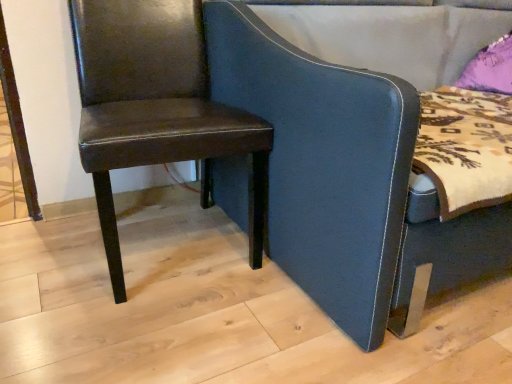
How much space does dark blue leather chair at center, the 2th chair in the left-to-right sequence, occupy horizontally?

dark blue leather chair at center, the 2th chair in the left-to-right sequence, is 3.59 feet in width.

This screenshot has height=384, width=512. Describe the element at coordinates (345, 179) in the screenshot. I see `dark blue leather chair at center, which is the 1th chair in right-to-left order` at that location.

Locate an element on the screen. The height and width of the screenshot is (384, 512). dark blue leather chair at center, the 2th chair in the left-to-right sequence is located at coordinates (345, 179).

How much space does matte brown leather chair at left, acting as the 2th chair starting from the right, occupy vertically?

Answer: matte brown leather chair at left, acting as the 2th chair starting from the right, is 73.87 centimeters tall.

The image size is (512, 384). What do you see at coordinates (156, 107) in the screenshot? I see `matte brown leather chair at left, placed as the 1th chair when sorted from left to right` at bounding box center [156, 107].

The image size is (512, 384). What are the coordinates of `matte brown leather chair at left, placed as the 1th chair when sorted from left to right` in the screenshot? It's located at (156, 107).

Locate an element on the screen. This screenshot has width=512, height=384. dark blue leather chair at center, which is the 1th chair in right-to-left order is located at coordinates (345, 179).

Between dark blue leather chair at center, the 2th chair in the left-to-right sequence, and matte brown leather chair at left, acting as the 2th chair starting from the right, which one appears on the right side from the viewer's perspective?

dark blue leather chair at center, the 2th chair in the left-to-right sequence, is more to the right.

Is dark blue leather chair at center, which is the 1th chair in right-to-left order, in front of matte brown leather chair at left, placed as the 1th chair when sorted from left to right?

Yes, the depth of dark blue leather chair at center, which is the 1th chair in right-to-left order, is less than that of matte brown leather chair at left, placed as the 1th chair when sorted from left to right.

Which point is more forward, (220, 56) or (258, 131)?

The point (258, 131) is closer to the camera.

From the image's perspective, is dark blue leather chair at center, which is the 1th chair in right-to-left order, below matte brown leather chair at left, acting as the 2th chair starting from the right?

Actually, dark blue leather chair at center, which is the 1th chair in right-to-left order, appears above matte brown leather chair at left, acting as the 2th chair starting from the right, in the image.

From a real-world perspective, is dark blue leather chair at center, which is the 1th chair in right-to-left order, on matte brown leather chair at left, acting as the 2th chair starting from the right?

Yes, from a real-world perspective, dark blue leather chair at center, which is the 1th chair in right-to-left order, is on top of matte brown leather chair at left, acting as the 2th chair starting from the right.

Between dark blue leather chair at center, the 2th chair in the left-to-right sequence, and matte brown leather chair at left, placed as the 1th chair when sorted from left to right, which one has larger width?

Wider between the two is dark blue leather chair at center, the 2th chair in the left-to-right sequence.

Is dark blue leather chair at center, the 2th chair in the left-to-right sequence, shorter than matte brown leather chair at left, acting as the 2th chair starting from the right?

No, dark blue leather chair at center, the 2th chair in the left-to-right sequence, is not shorter than matte brown leather chair at left, acting as the 2th chair starting from the right.

In terms of size, does dark blue leather chair at center, the 2th chair in the left-to-right sequence, appear bigger or smaller than matte brown leather chair at left, placed as the 1th chair when sorted from left to right?

Considering their sizes, dark blue leather chair at center, the 2th chair in the left-to-right sequence, takes up more space than matte brown leather chair at left, placed as the 1th chair when sorted from left to right.

Choose the correct answer: Is dark blue leather chair at center, which is the 1th chair in right-to-left order, inside matte brown leather chair at left, placed as the 1th chair when sorted from left to right, or outside it?

dark blue leather chair at center, which is the 1th chair in right-to-left order, is not enclosed by matte brown leather chair at left, placed as the 1th chair when sorted from left to right.

Is dark blue leather chair at center, the 2th chair in the left-to-right sequence, not near matte brown leather chair at left, placed as the 1th chair when sorted from left to right?

No, dark blue leather chair at center, the 2th chair in the left-to-right sequence, is not far away from matte brown leather chair at left, placed as the 1th chair when sorted from left to right.

Is dark blue leather chair at center, which is the 1th chair in right-to-left order, facing away from matte brown leather chair at left, placed as the 1th chair when sorted from left to right?

No.

What's the angular difference between dark blue leather chair at center, the 2th chair in the left-to-right sequence, and matte brown leather chair at left, placed as the 1th chair when sorted from left to right,'s facing directions?

4.1 degrees.

Identify the location of chair that appears behind the dark blue leather chair at center, the 2th chair in the left-to-right sequence. (156, 107).

Considering the positions of objects matte brown leather chair at left, placed as the 1th chair when sorted from left to right, and dark blue leather chair at center, which is the 1th chair in right-to-left order, in the image provided, who is more to the left, matte brown leather chair at left, placed as the 1th chair when sorted from left to right, or dark blue leather chair at center, which is the 1th chair in right-to-left order,?

From the viewer's perspective, matte brown leather chair at left, placed as the 1th chair when sorted from left to right, appears more on the left side.

Between matte brown leather chair at left, placed as the 1th chair when sorted from left to right, and dark blue leather chair at center, which is the 1th chair in right-to-left order, which one is positioned behind?

matte brown leather chair at left, placed as the 1th chair when sorted from left to right, is further away from the camera.

Considering the positions of points (148, 97) and (376, 116), is point (148, 97) closer to camera compared to point (376, 116)?

No.

From the image's perspective, which one is positioned lower, matte brown leather chair at left, acting as the 2th chair starting from the right, or dark blue leather chair at center, the 2th chair in the left-to-right sequence?

matte brown leather chair at left, acting as the 2th chair starting from the right, from the image's perspective.

From a real-world perspective, which is physically above, matte brown leather chair at left, placed as the 1th chair when sorted from left to right, or dark blue leather chair at center, which is the 1th chair in right-to-left order?

dark blue leather chair at center, which is the 1th chair in right-to-left order, from a real-world perspective.

Which object is thinner, matte brown leather chair at left, placed as the 1th chair when sorted from left to right, or dark blue leather chair at center, the 2th chair in the left-to-right sequence?

With smaller width is matte brown leather chair at left, placed as the 1th chair when sorted from left to right.

Based on the photo, which of these two, matte brown leather chair at left, acting as the 2th chair starting from the right, or dark blue leather chair at center, which is the 1th chair in right-to-left order, stands shorter?

matte brown leather chair at left, acting as the 2th chair starting from the right.

Based on the photo, who is smaller, matte brown leather chair at left, acting as the 2th chair starting from the right, or dark blue leather chair at center, the 2th chair in the left-to-right sequence?

matte brown leather chair at left, acting as the 2th chair starting from the right, is smaller.

Is dark blue leather chair at center, which is the 1th chair in right-to-left order, completely or partially inside matte brown leather chair at left, acting as the 2th chair starting from the right?

Definitely not — dark blue leather chair at center, which is the 1th chair in right-to-left order, is not inside matte brown leather chair at left, acting as the 2th chair starting from the right.

Are matte brown leather chair at left, acting as the 2th chair starting from the right, and dark blue leather chair at center, the 2th chair in the left-to-right sequence, located far from each other?

No, matte brown leather chair at left, acting as the 2th chair starting from the right, is not far away from dark blue leather chair at center, the 2th chair in the left-to-right sequence.

Does matte brown leather chair at left, placed as the 1th chair when sorted from left to right, turn towards dark blue leather chair at center, which is the 1th chair in right-to-left order?

No, matte brown leather chair at left, placed as the 1th chair when sorted from left to right, is not aimed at dark blue leather chair at center, which is the 1th chair in right-to-left order.

How many degrees apart are the facing directions of matte brown leather chair at left, acting as the 2th chair starting from the right, and dark blue leather chair at center, the 2th chair in the left-to-right sequence?

4.1 degrees.

This screenshot has height=384, width=512. In order to click on chair above the matte brown leather chair at left, acting as the 2th chair starting from the right (from the image's perspective) in this screenshot , I will do `click(345, 179)`.

At what (x,y) coordinates should I click in order to perform the action: click on chair lying in front of the matte brown leather chair at left, placed as the 1th chair when sorted from left to right. Please return your answer as a coordinate pair (x, y). The width and height of the screenshot is (512, 384). Looking at the image, I should click on (345, 179).

Find the location of a particular element. This screenshot has width=512, height=384. chair behind the dark blue leather chair at center, the 2th chair in the left-to-right sequence is located at coordinates (156, 107).